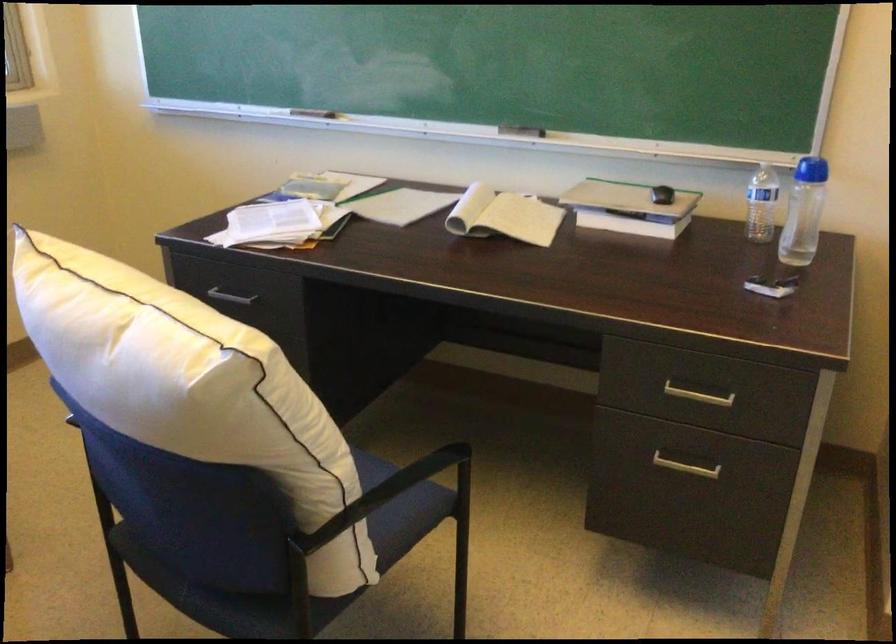
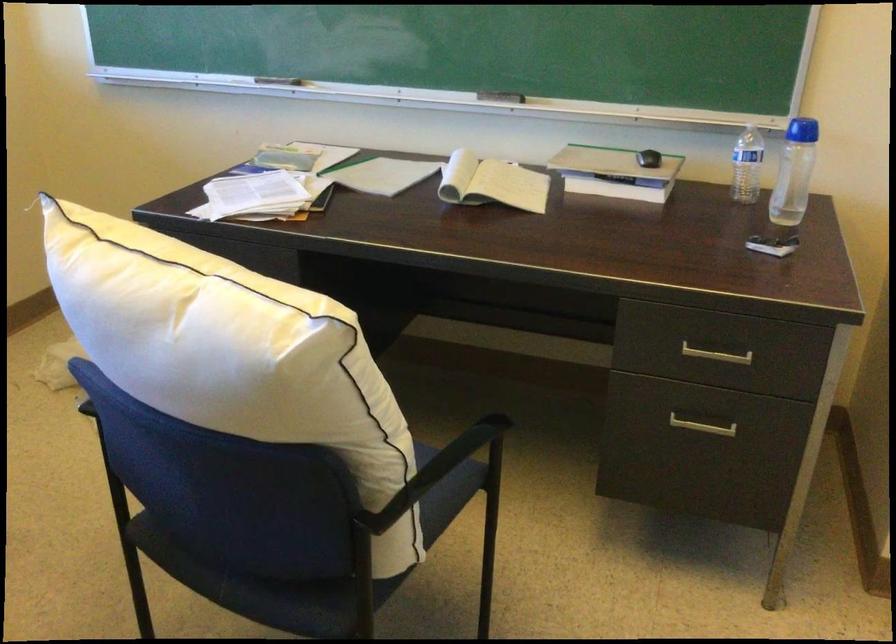
Question: I am providing you with two images of the same scene from different viewpoints. Please identify which objects are invisible in image2.

Choices:
 (A) chalkboard eraser
 (B) clear water bottle
 (C) black chair armrest
 (D) none of these

Answer: (D)